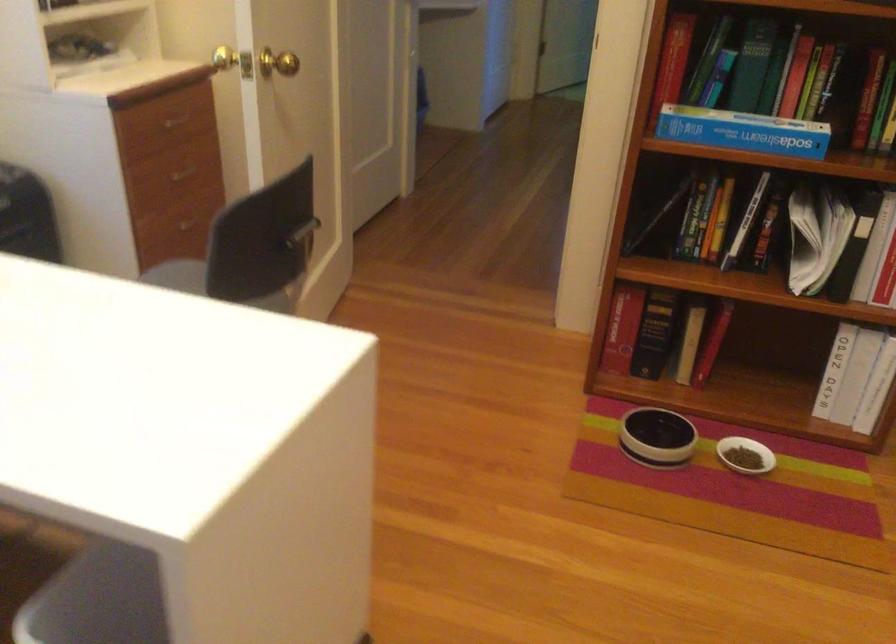
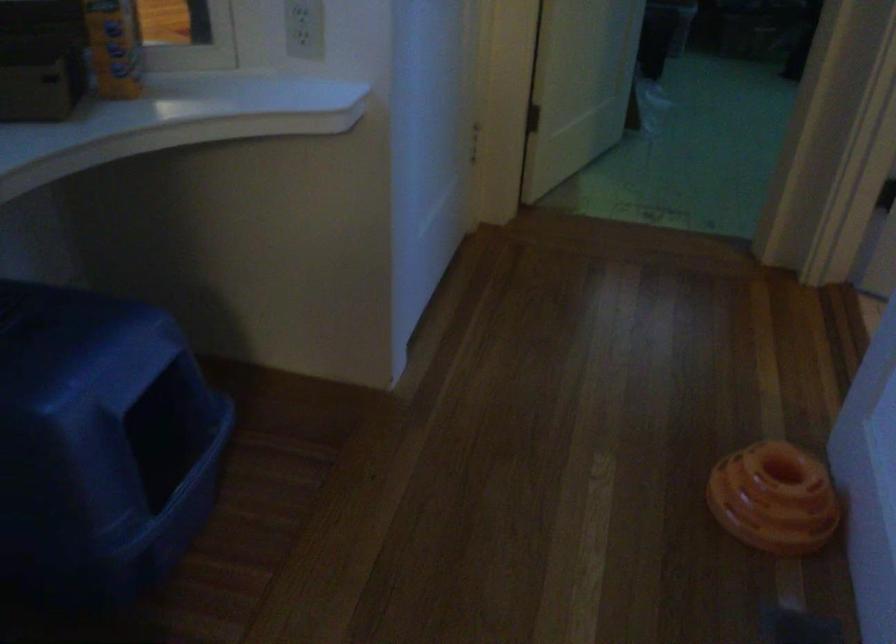
Question: In a continuous first-person perspective shot, in which direction is the camera moving?

Choices:
 (A) Left
 (B) Right
 (C) Forward
 (D) Backward

Answer: (C)